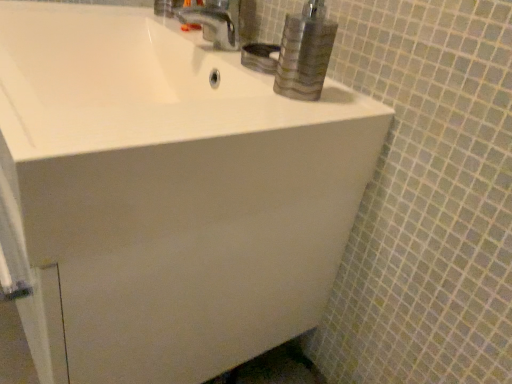
Question: Could you tell me if metallic silver faucet at upper center is turned towards white glossy sink at upper center?

Choices:
 (A) no
 (B) yes

Answer: (A)

Question: Is metallic silver faucet at upper center far from white glossy sink at upper center?

Choices:
 (A) yes
 (B) no

Answer: (B)

Question: Can you confirm if metallic silver faucet at upper center is shorter than white glossy sink at upper center?

Choices:
 (A) yes
 (B) no

Answer: (B)

Question: Considering the relative positions of metallic silver faucet at upper center and white glossy sink at upper center in the image provided, is metallic silver faucet at upper center in front of white glossy sink at upper center?

Choices:
 (A) no
 (B) yes

Answer: (A)

Question: Does metallic silver faucet at upper center have a larger size compared to white glossy sink at upper center?

Choices:
 (A) no
 (B) yes

Answer: (A)

Question: Is metallic silver faucet at upper center placed right next to white glossy sink at upper center?

Choices:
 (A) no
 (B) yes

Answer: (A)

Question: Is white glossy sink at upper center directly adjacent to metallic silver faucet at upper center?

Choices:
 (A) yes
 (B) no

Answer: (B)

Question: Is white glossy sink at upper center outside metallic silver faucet at upper center?

Choices:
 (A) no
 (B) yes

Answer: (B)

Question: Is white glossy sink at upper center at the right side of metallic silver faucet at upper center?

Choices:
 (A) yes
 (B) no

Answer: (B)

Question: Is the depth of white glossy sink at upper center less than that of metallic silver faucet at upper center?

Choices:
 (A) no
 (B) yes

Answer: (B)

Question: Is white glossy sink at upper center positioned behind metallic silver faucet at upper center?

Choices:
 (A) yes
 (B) no

Answer: (B)

Question: Considering the relative sizes of white glossy sink at upper center and metallic silver faucet at upper center in the image provided, is white glossy sink at upper center shorter than metallic silver faucet at upper center?

Choices:
 (A) no
 (B) yes

Answer: (B)

Question: Is white glossy sink at upper center bigger or smaller than metallic silver faucet at upper center?

Choices:
 (A) small
 (B) big

Answer: (B)